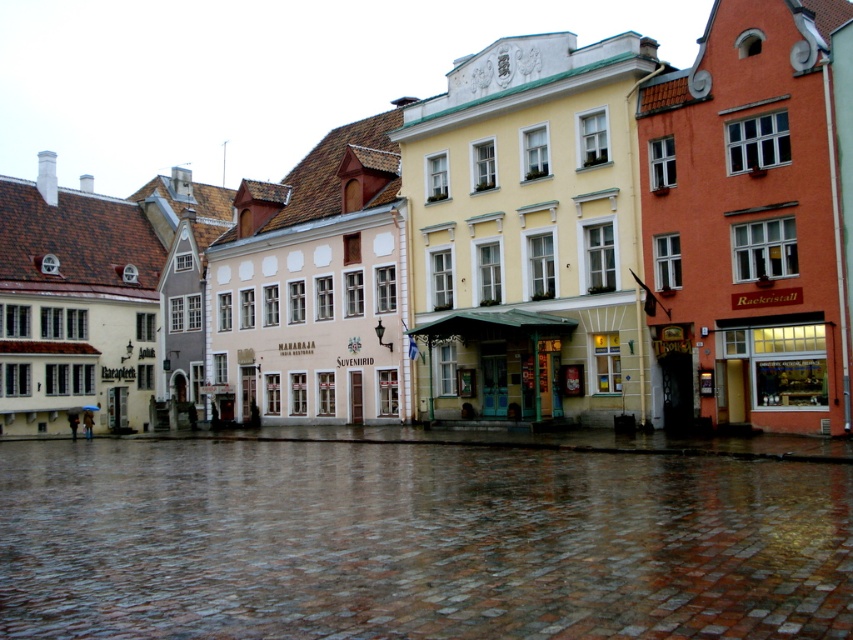
What do you see at coordinates (415, 541) in the screenshot? I see `brown stone pavement at lower center` at bounding box center [415, 541].

Who is more distant from viewer, (155, 520) or (415, 328)?

The point (415, 328) is behind.

This screenshot has height=640, width=853. I want to click on brown stone pavement at lower center, so click(415, 541).

Does matte glass storefront at right appear over green glass kiosk at center?

Yes.

Between matte glass storefront at right and green glass kiosk at center, which one appears on the right side from the viewer's perspective?

Positioned to the right is matte glass storefront at right.

Which is in front, point (715, 362) or point (498, 326)?

Positioned in front is point (715, 362).

You are a GUI agent. You are given a task and a screenshot of the screen. Output one action in this format:
    pyautogui.click(x=<x>, y=<y>)
    Task: Click on the matte glass storefront at right
    
    Given the screenshot: What is the action you would take?
    pyautogui.click(x=772, y=376)

Is point (759, 477) positioned before point (744, 346)?

Yes, point (759, 477) is in front of point (744, 346).

Which is above, brown stone pavement at lower center or matte glass storefront at right?

Positioned higher is matte glass storefront at right.

This screenshot has height=640, width=853. In order to click on brown stone pavement at lower center in this screenshot , I will do [x=415, y=541].